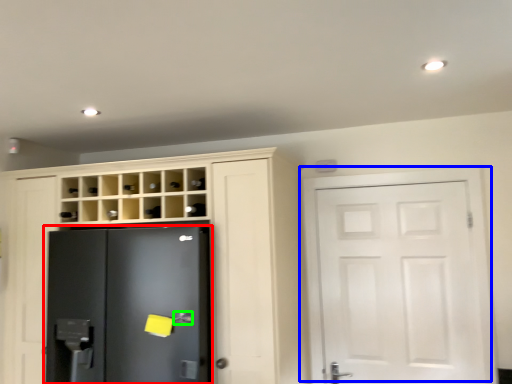
Question: Estimate the real-world distances between objects in this image. Which object is closer to refrigerator (highlighted by a red box), door (highlighted by a blue box) or door handle (highlighted by a green box)?

Choices:
 (A) door
 (B) door handle

Answer: (B)